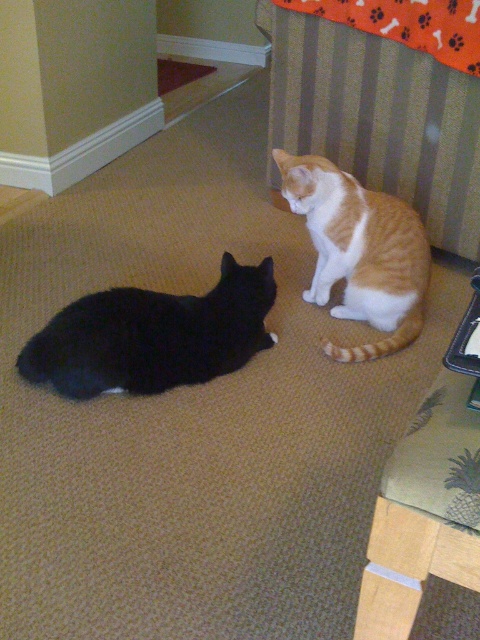
Can you confirm if black matte fur cat at lower left is wider than orange tabby cat at upper right?

Yes.

Who is lower down, black matte fur cat at lower left or orange tabby cat at upper right?

Positioned lower is black matte fur cat at lower left.

Describe the element at coordinates (153, 337) in the screenshot. I see `black matte fur cat at lower left` at that location.

The width and height of the screenshot is (480, 640). In order to click on black matte fur cat at lower left in this screenshot , I will do `click(153, 337)`.

Is point (392, 330) positioned in front of point (177, 88)?

Yes, it is.

Does orange tabby cat at upper right have a lesser height compared to brown carpet at upper left?

No, orange tabby cat at upper right is not shorter than brown carpet at upper left.

Locate an element on the screen. This screenshot has width=480, height=640. orange tabby cat at upper right is located at coordinates (360, 252).

Does black matte fur cat at lower left appear over brown carpet at upper left?

No.

What do you see at coordinates (153, 337) in the screenshot? I see `black matte fur cat at lower left` at bounding box center [153, 337].

Find the location of a particular element. black matte fur cat at lower left is located at coordinates (153, 337).